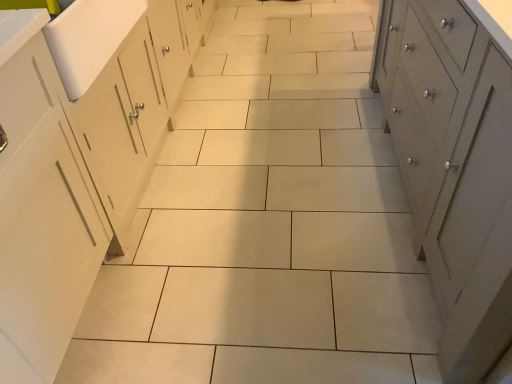
Question: Is white painted wood cabinet at right bigger or smaller than white glossy sink at left?

Choices:
 (A) small
 (B) big

Answer: (B)

Question: Considering the positions of point (475, 364) and point (82, 89), is point (475, 364) closer or farther from the camera than point (82, 89)?

Choices:
 (A) farther
 (B) closer

Answer: (B)

Question: Relative to white glossy sink at left, is white painted wood cabinet at right in front or behind?

Choices:
 (A) behind
 (B) front

Answer: (B)

Question: Does point (97, 56) appear closer or farther from the camera than point (433, 281)?

Choices:
 (A) closer
 (B) farther

Answer: (B)

Question: From the image's perspective, is white glossy sink at left above or below white painted wood cabinet at right?

Choices:
 (A) above
 (B) below

Answer: (A)

Question: From a real-world perspective, is white glossy sink at left physically located above or below white painted wood cabinet at right?

Choices:
 (A) below
 (B) above

Answer: (B)

Question: Is white glossy sink at left bigger or smaller than white painted wood cabinet at right?

Choices:
 (A) big
 (B) small

Answer: (B)